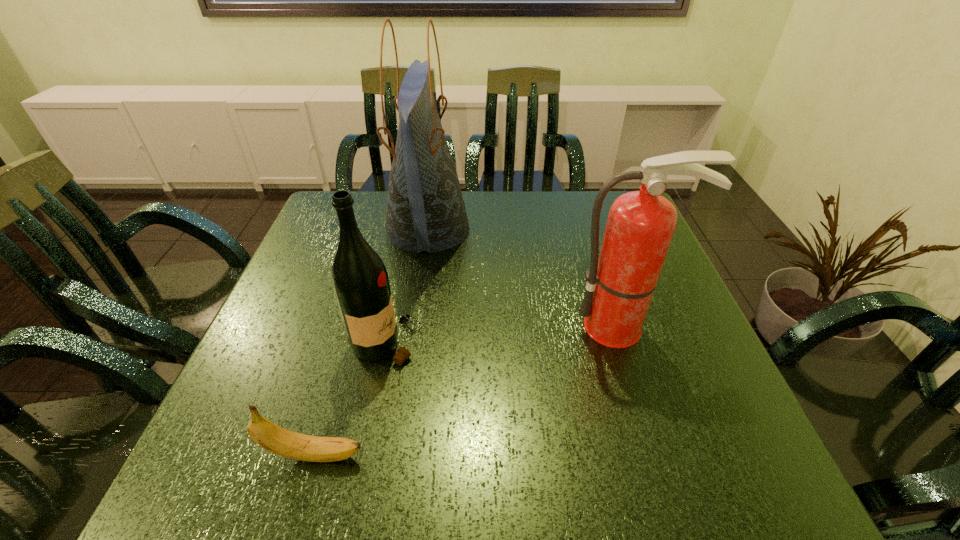
Locate an element on the screen. This screenshot has width=960, height=540. vacant position in the image that satisfies the following two spatial constraints: 1. with the handle and hose on the rightmost object; 2. on the surface of the wine bottle is located at coordinates (626, 343).

The height and width of the screenshot is (540, 960). What are the coordinates of `free space that satisfies the following two spatial constraints: 1. with the handle and hose on the fire extinguisher; 2. on the surface of the wine bottle` in the screenshot? It's located at (626, 343).

Where is `vacant space that satisfies the following two spatial constraints: 1. on the front side of the shopping bag; 2. at the start of the peel on the nearest object`? vacant space that satisfies the following two spatial constraints: 1. on the front side of the shopping bag; 2. at the start of the peel on the nearest object is located at coordinates (393, 455).

Locate an element on the screen. This screenshot has width=960, height=540. free space that satisfies the following two spatial constraints: 1. on the front side of the shopping bag; 2. at the start of the peel on the shortest object is located at coordinates (393, 455).

The height and width of the screenshot is (540, 960). What are the coordinates of `vacant area that satisfies the following two spatial constraints: 1. with the handle and hose on the fire extinguisher; 2. on the surface of the wine bottle` in the screenshot? It's located at (626, 343).

Identify the location of vacant area that satisfies the following two spatial constraints: 1. with the handle and hose on the fire extinguisher; 2. on the surface of the wine bottle. The image size is (960, 540). (626, 343).